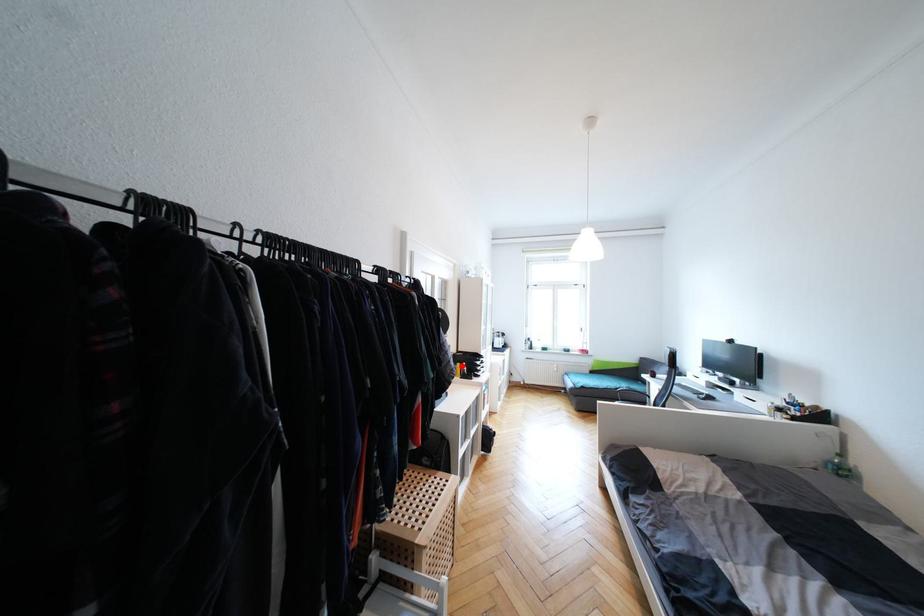
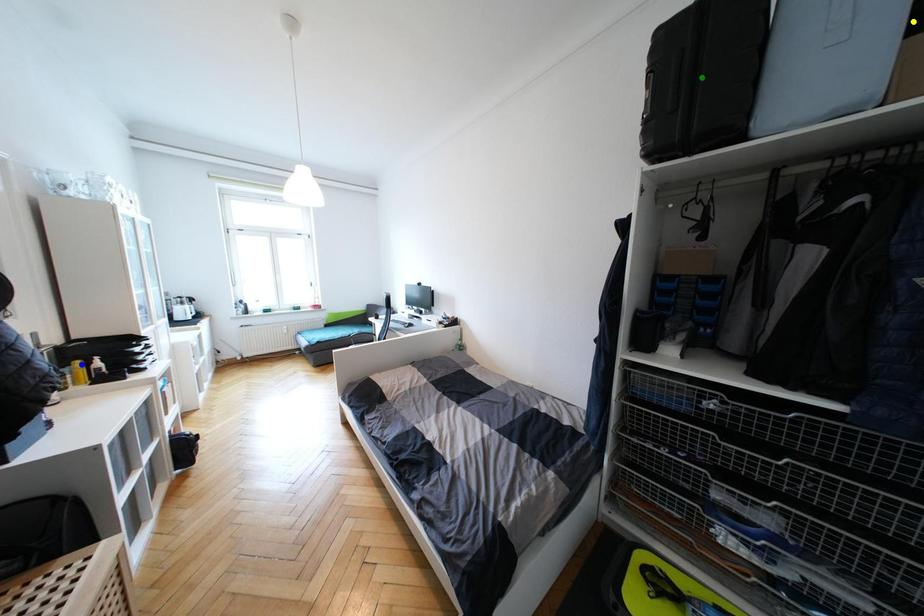
Question: I am providing you with two images of the same scene from different viewpoints. A red point is marked on the first image. You are given multiple points on the second image. Which mark in image 2 goes with the point in image 1?

Choices:
 (A) blue point
 (B) yellow point
 (C) green point

Answer: (A)